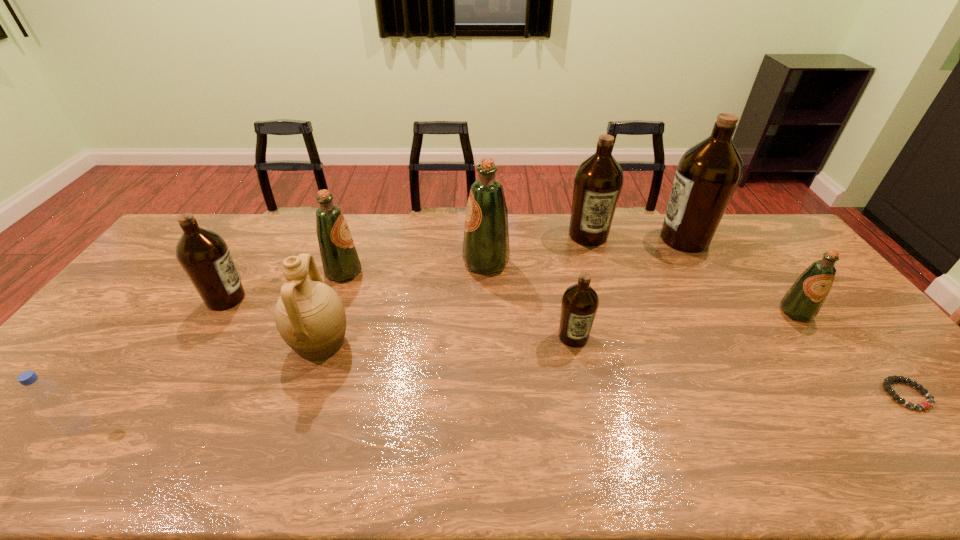
The height and width of the screenshot is (540, 960). Identify the location of green olive oil that is the second closest to the biggest green olive oil. (802, 302).

You are a GUI agent. You are given a task and a screenshot of the screen. Output one action in this format:
    pyautogui.click(x=<x>, y=<y>)
    Task: Click on the vacant region that satisfies the following two spatial constraints: 1. on the back side of the bracelet; 2. on the label of the second smallest brown olive oil
    
    Given the screenshot: What is the action you would take?
    pyautogui.click(x=825, y=299)

At what (x,y) coordinates should I click in order to perform the action: click on vacant space that satisfies the following two spatial constraints: 1. on the label of the bracelet; 2. on the right side of the third object from right to left. Please return your answer as a coordinate pair (x, y). The height and width of the screenshot is (540, 960). Looking at the image, I should click on pos(776,394).